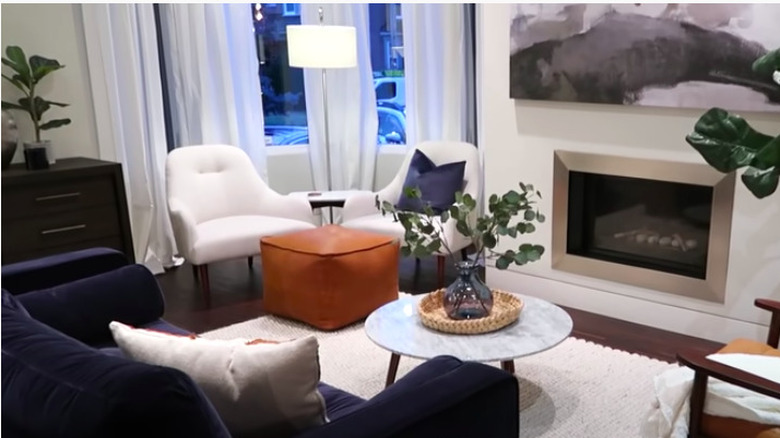
Where is `lamp`? lamp is located at coordinates (324, 40).